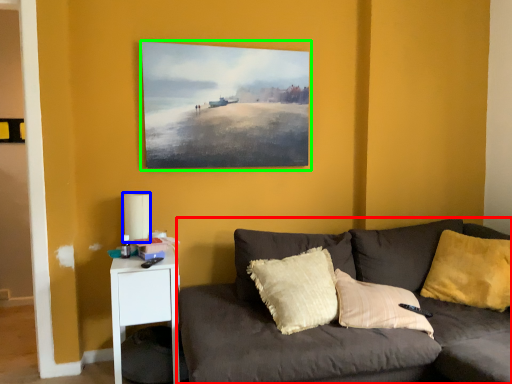
Question: Considering the real-world distances, which object is closest to studio couch (highlighted by a red box)? lamp (highlighted by a blue box) or picture frame (highlighted by a green box).

Choices:
 (A) lamp
 (B) picture frame

Answer: (B)